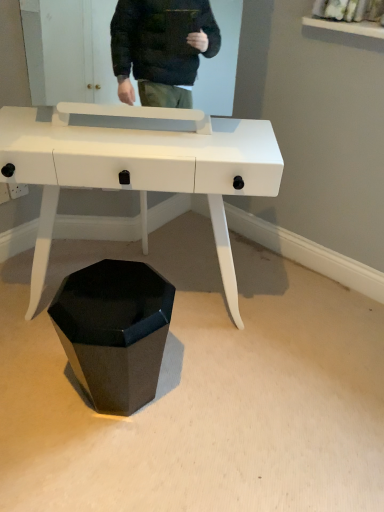
Question: Based on their positions, is glossy black hexagonal at lower center located to the left or right of white glossy desk at center?

Choices:
 (A) right
 (B) left

Answer: (B)

Question: Relative to white glossy desk at center, is glossy black hexagonal at lower center in front or behind?

Choices:
 (A) front
 (B) behind

Answer: (B)

Question: Does point (124, 372) appear closer or farther from the camera than point (144, 173)?

Choices:
 (A) farther
 (B) closer

Answer: (A)

Question: Do you think white glossy desk at center is within glossy black hexagonal at lower center, or outside of it?

Choices:
 (A) inside
 (B) outside

Answer: (B)

Question: Is white glossy desk at center taller or shorter than glossy black hexagonal at lower center?

Choices:
 (A) tall
 (B) short

Answer: (A)

Question: From the image's perspective, is white glossy desk at center positioned above or below glossy black hexagonal at lower center?

Choices:
 (A) above
 (B) below

Answer: (A)

Question: Is white glossy desk at center in front of or behind glossy black hexagonal at lower center in the image?

Choices:
 (A) front
 (B) behind

Answer: (A)